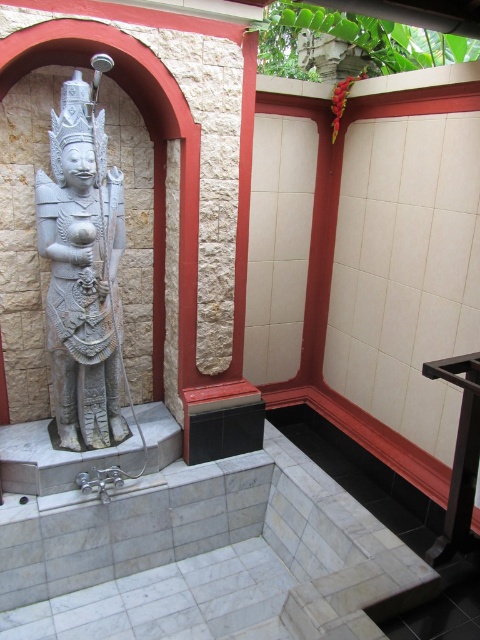
Question: Which point appears farthest from the camera in this image?

Choices:
 (A) (106, 250)
 (B) (474, 429)

Answer: (A)

Question: Which of the following is the closest to the observer?

Choices:
 (A) pos(460,419)
 (B) pos(72,252)

Answer: (A)

Question: Where is gray stone statue at left located in relation to black plastic stool at lower right in the image?

Choices:
 (A) above
 (B) below

Answer: (A)

Question: Considering the relative positions of gray stone statue at left and black plastic stool at lower right in the image provided, where is gray stone statue at left located with respect to black plastic stool at lower right?

Choices:
 (A) left
 (B) right

Answer: (A)

Question: Is gray stone statue at left to the left of black plastic stool at lower right from the viewer's perspective?

Choices:
 (A) yes
 (B) no

Answer: (A)